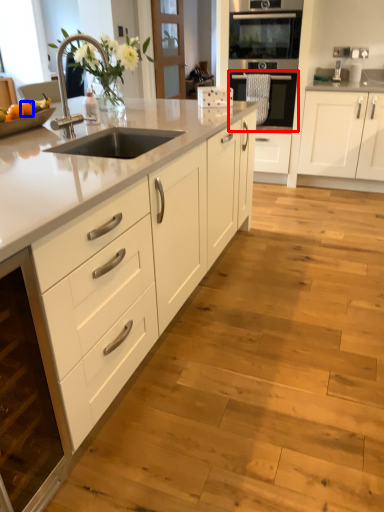
Question: Which point is further to the camera, oven (highlighted by a red box) or orange (highlighted by a blue box)?

Choices:
 (A) oven
 (B) orange

Answer: (A)